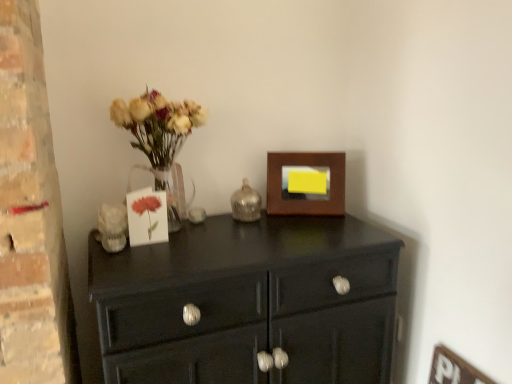
Where is `free area in between wooden picture frame at upper right and white matte card at center`? free area in between wooden picture frame at upper right and white matte card at center is located at coordinates (242, 225).